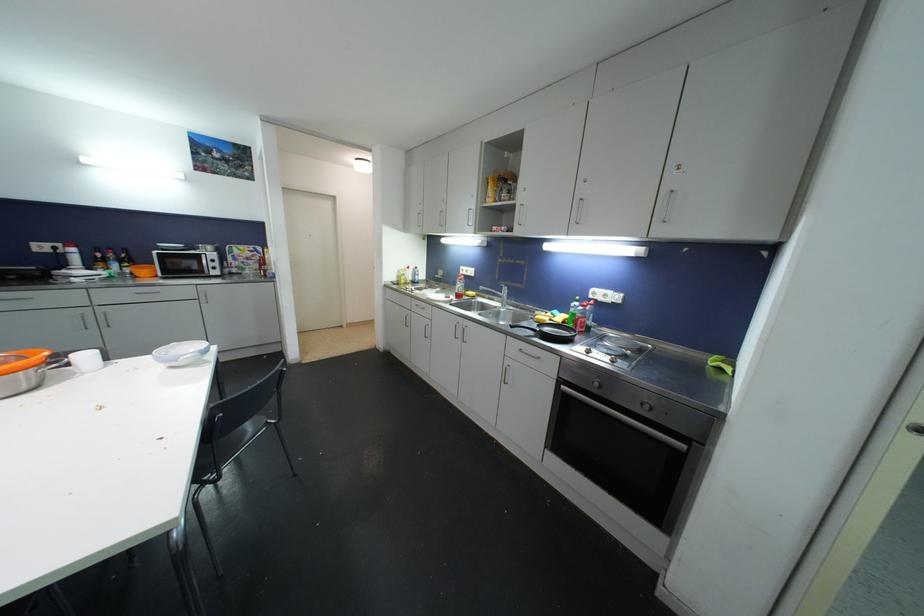
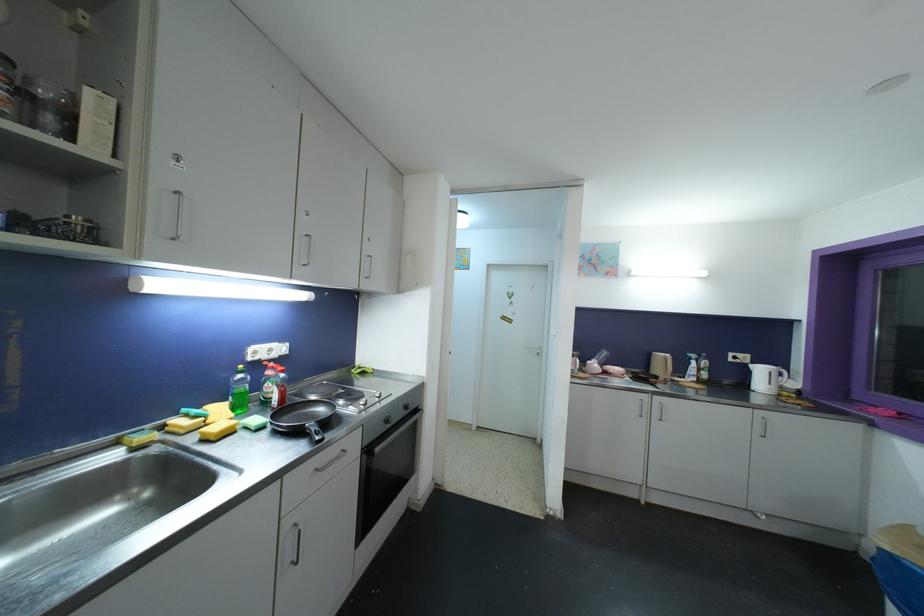
The point at (579, 306) is marked in the first image. Where is the corresponding point in the second image?

(244, 379)